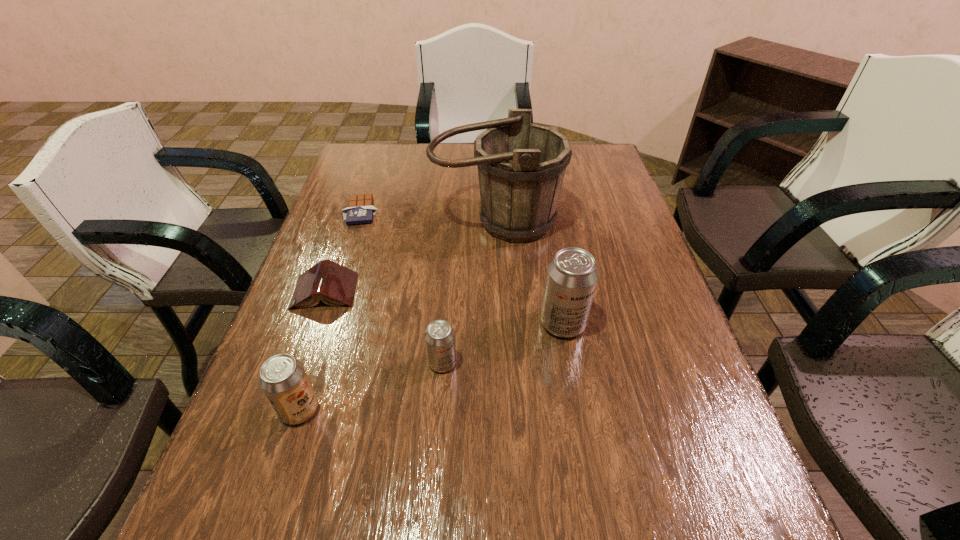
Where is `vacant region at the right edge of the desktop`? The width and height of the screenshot is (960, 540). vacant region at the right edge of the desktop is located at coordinates (674, 426).

The image size is (960, 540). In the image, there is a desktop. Find the location of `vacant region at the far left corner`. vacant region at the far left corner is located at coordinates (369, 145).

Image resolution: width=960 pixels, height=540 pixels. What are the coordinates of `free region at the far right corner` in the screenshot? It's located at (613, 174).

Find the location of `free space between the farthest beer can and the book`. free space between the farthest beer can and the book is located at coordinates point(444,307).

This screenshot has width=960, height=540. Identify the location of free space between the chocolate bar and the farthest beer can. (463, 267).

The width and height of the screenshot is (960, 540). In order to click on free spot between the chocolate bar and the second shortest object in this screenshot , I will do `click(344, 251)`.

Where is `free spot between the book and the nearest beer can`? The image size is (960, 540). free spot between the book and the nearest beer can is located at coordinates (312, 350).

Locate an element on the screen. The height and width of the screenshot is (540, 960). free area in between the book and the tallest object is located at coordinates 411,256.

Identify the location of unoccupied area between the farthest beer can and the bucket. 529,272.

Find the location of `vacant region between the shortest object and the bucket`. vacant region between the shortest object and the bucket is located at coordinates (429, 216).